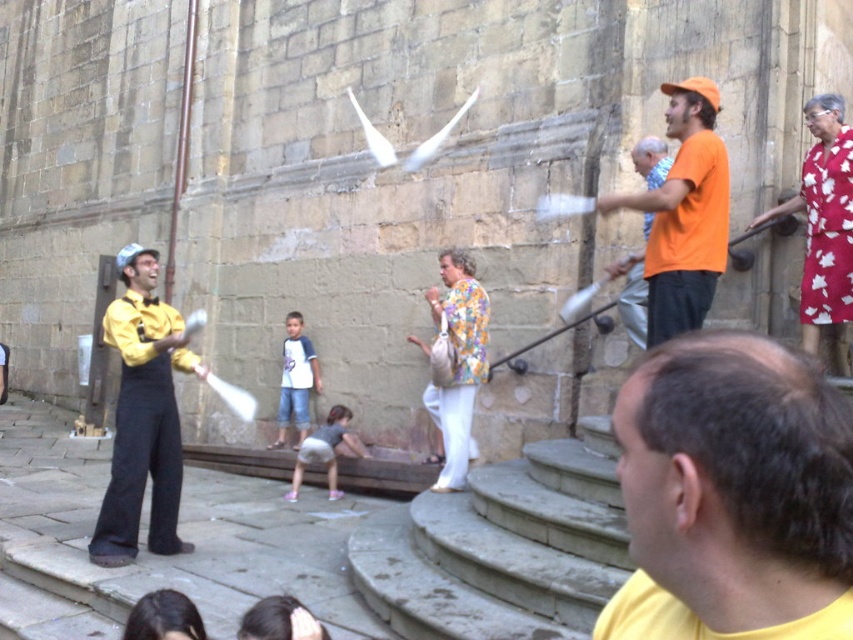
You are a photographer trying to capture both performers in a portrait. Given that the yellow matte shirt at lower right is narrower than the orange cotton shirt at right, which performer should you position closer to the camera to ensure both appear equally sized in the photo?

To make both performers appear equally sized in the photo, position the yellow matte shirt at lower right closer to the camera since it has a smaller width compared to the orange cotton shirt at right. This adjustment will help balance their sizes in the frame.

You are a spectator at the street performance. You notice two performers wearing yellow shirts. Which performer is closer to you, the one in the yellow matte shirt at lower right or the one in the yellow satin shirt at center?

The yellow matte shirt at lower right is positioned over the yellow satin shirt at center, so the performer in the yellow matte shirt at lower right is closer to you.

You are a photographer standing in front of the stone building and want to capture both performers in your photo. Given that the yellow satin shirt at center is much taller than the orange cotton shirt at right, which performer should you position closer to the camera to ensure both are visible in the frame?

You should position the orange cotton shirt at right closer to the camera because the yellow satin shirt at center is much taller, so adjusting their positions can balance their visibility in the photo.